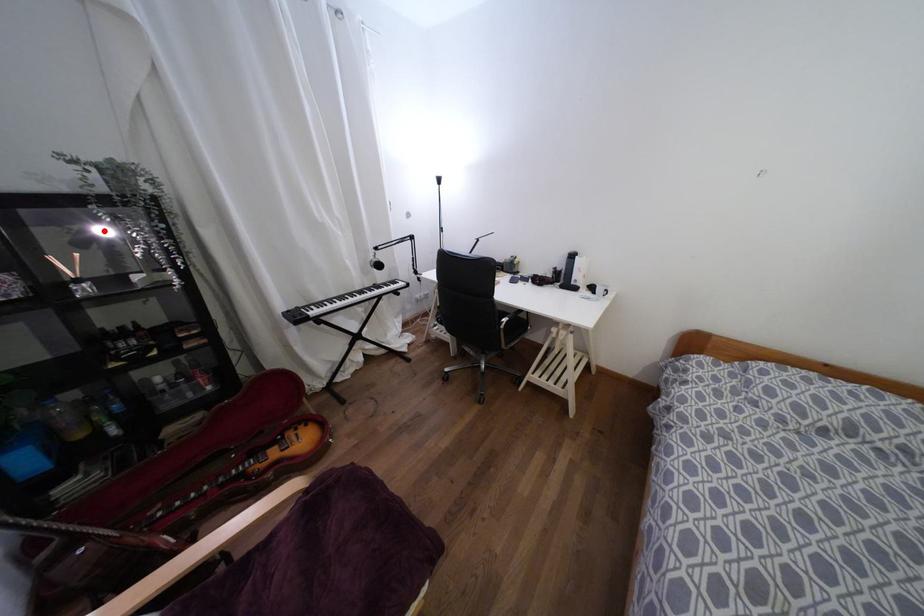
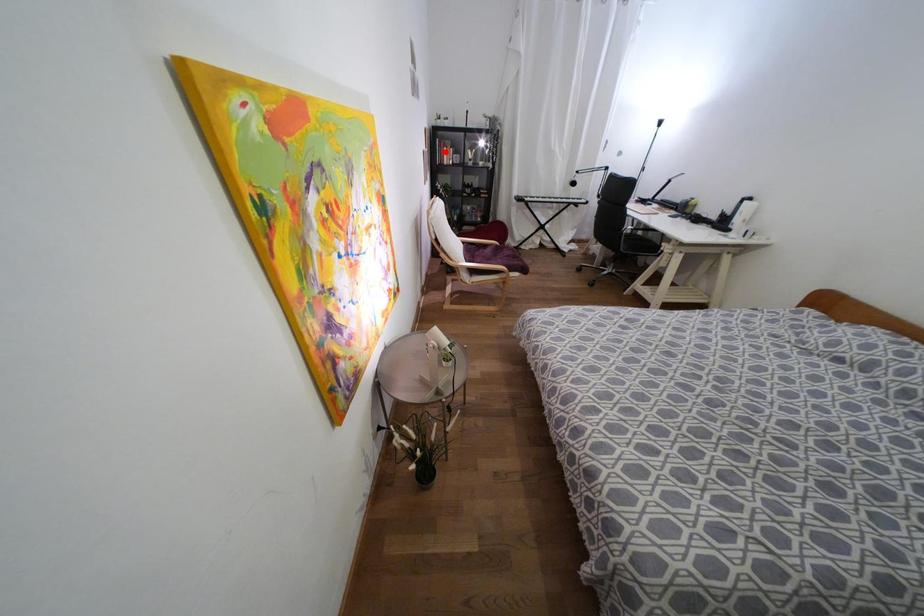
I am providing you with two images of the same scene from different viewpoints. A red point is marked on the first image and another point is marked on the second image. Do the highlighted points in image1 and image2 indicate the same real-world spot?

No